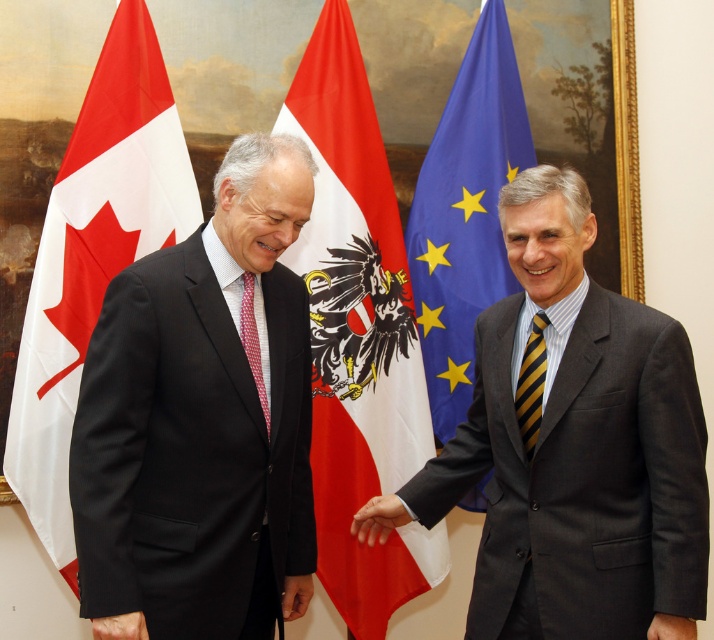
Question: Does matte black hand at lower left have a larger size compared to smooth black suit at center?

Choices:
 (A) no
 (B) yes

Answer: (B)

Question: Considering the relative positions of white fabric flag at left and matte black hand at lower left in the image provided, where is white fabric flag at left located with respect to matte black hand at lower left?

Choices:
 (A) below
 (B) above

Answer: (B)

Question: Does matte black hand at lower left have a lesser width compared to smooth black suit at center?

Choices:
 (A) no
 (B) yes

Answer: (A)

Question: Which of the following is the farthest from the observer?

Choices:
 (A) white fabric flag at left
 (B) smooth skin hand at center

Answer: (A)

Question: Which object appears closest to the camera in this image?

Choices:
 (A) black wool suit at left
 (B) dark gray suit at right

Answer: (B)

Question: Among these objects, which one is farthest from the camera?

Choices:
 (A) black wool suit at left
 (B) red/white fabric flag at center

Answer: (B)